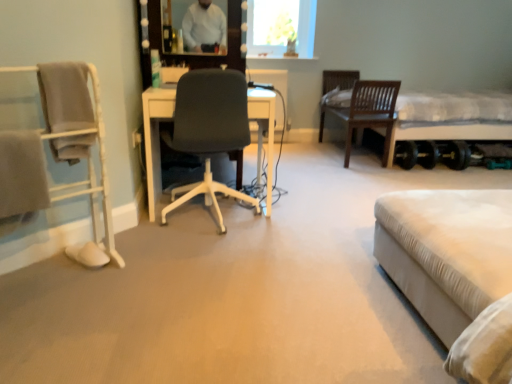
Question: Does point (448, 99) appear closer or farther from the camera than point (22, 211)?

Choices:
 (A) farther
 (B) closer

Answer: (A)

Question: From the image's perspective, is white fabric bed at right, the 1th bed positioned from the top, above or below white fabric chair at left, which is the 1th chair from front to back?

Choices:
 (A) below
 (B) above

Answer: (B)

Question: Which object is positioned farthest from the white fabric bed at right, which is the 2th bed in front-to-back order?

Choices:
 (A) white fabric bed at lower right, acting as the 2th bed starting from the top
 (B) matte white mirror at upper center
 (C) dark wood chair at center, which ranks as the 3th chair in left-to-right order
 (D) white fabric chair at left, placed as the 1th chair when sorted from left to right
 (E) transparent glass vase at upper center

Answer: (D)

Question: Which of these objects is positioned farthest from the transparent glass vase at upper center?

Choices:
 (A) white fabric bed at lower right, which ranks as the 1th bed in bottom-to-top order
 (B) matte white mirror at upper center
 (C) dark wood chair at center, which is the first chair in right-to-left order
 (D) black fabric chair at center, which appears as the 2th chair when viewed from the right
 (E) white fabric chair at left, acting as the 3th chair starting from the right

Answer: (A)